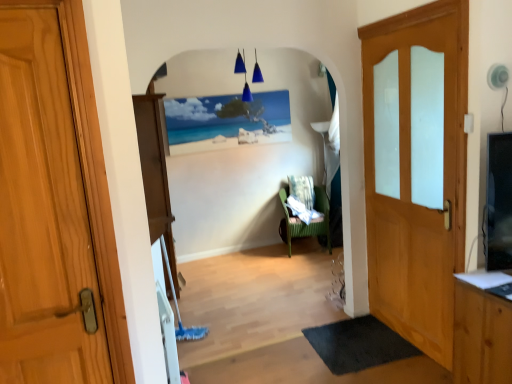
This screenshot has height=384, width=512. Find the location of `free space to the left of wooden door with frosted glass panels at right, the 1th door in the right-to-left sequence`. free space to the left of wooden door with frosted glass panels at right, the 1th door in the right-to-left sequence is located at coordinates (342, 349).